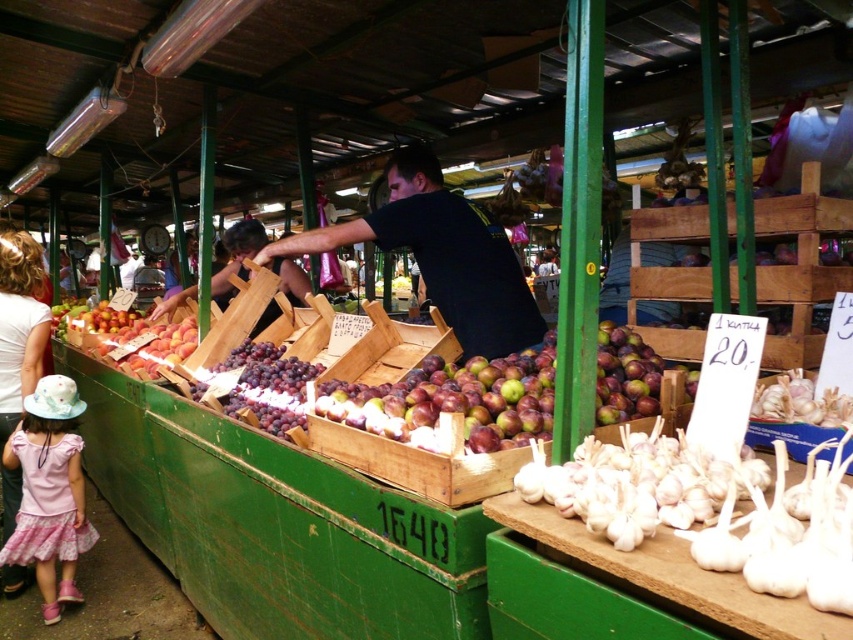
Who is lower down, pink floral dress at lower left or white cotton shirt at left?

Positioned lower is pink floral dress at lower left.

Which is more to the left, pink floral dress at lower left or white cotton shirt at left?

From the viewer's perspective, white cotton shirt at left appears more on the left side.

Is point (35, 483) in front of point (16, 577)?

Yes, it is.

Where is `pink floral dress at lower left`? pink floral dress at lower left is located at coordinates (49, 492).

Does black matte shirt at center have a larger size compared to pink floral dress at lower left?

Yes.

Between black matte shirt at center and pink floral dress at lower left, which one has less height?

black matte shirt at center is shorter.

The image size is (853, 640). Find the location of `black matte shirt at center`. black matte shirt at center is located at coordinates (440, 256).

Is point (355, 220) closer to viewer compared to point (25, 289)?

Yes, it is in front of point (25, 289).

Measure the distance between black matte shirt at center and white cotton shirt at left.

black matte shirt at center and white cotton shirt at left are 2.02 meters apart.

Locate an element on the screen. Image resolution: width=853 pixels, height=640 pixels. black matte shirt at center is located at coordinates (440, 256).